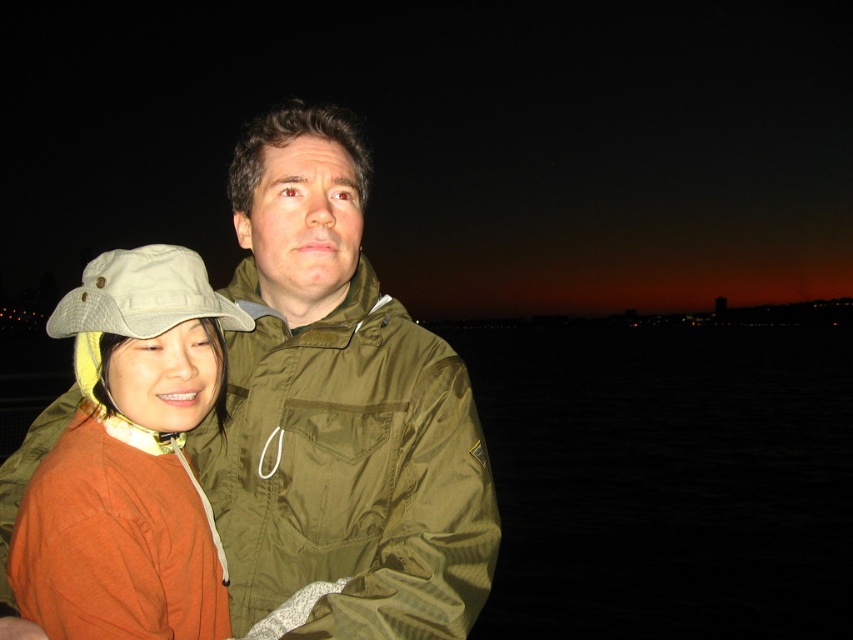
Question: Based on their relative distances, which object is nearer to the orange fabric shirt at left?

Choices:
 (A) orange matte jacket at center
 (B) olive green fabric jacket at center

Answer: (A)

Question: Is orange matte jacket at center to the right of orange fabric shirt at left from the viewer's perspective?

Choices:
 (A) yes
 (B) no

Answer: (A)

Question: Which object is the farthest from the orange matte jacket at center?

Choices:
 (A) orange fabric shirt at left
 (B) olive green fabric jacket at center

Answer: (A)

Question: Can you confirm if orange matte jacket at center is bigger than orange fabric shirt at left?

Choices:
 (A) no
 (B) yes

Answer: (B)

Question: Which of the following is the closest to the observer?

Choices:
 (A) (308, 339)
 (B) (178, 518)

Answer: (B)

Question: From the image, what is the correct spatial relationship of orange matte jacket at center in relation to orange fabric shirt at left?

Choices:
 (A) left
 (B) right

Answer: (B)